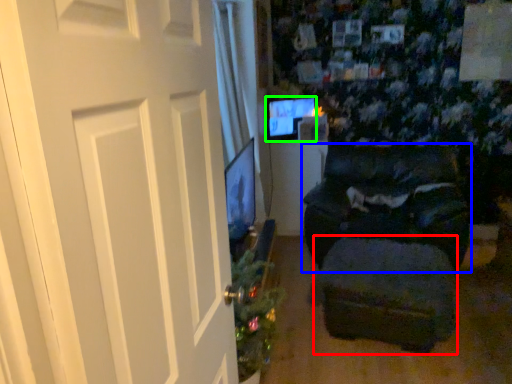
Question: Which object is positioned closest to footrest (highlighted by a red box)? Select from furniture (highlighted by a blue box) and computer monitor (highlighted by a green box).

Choices:
 (A) furniture
 (B) computer monitor

Answer: (A)